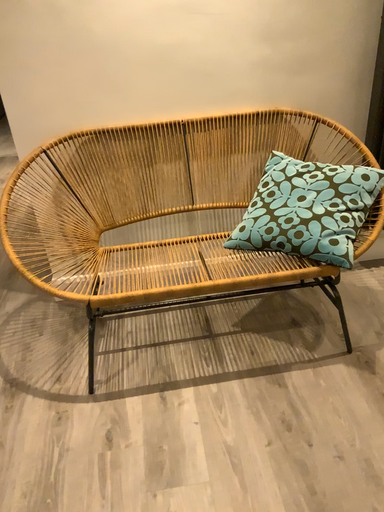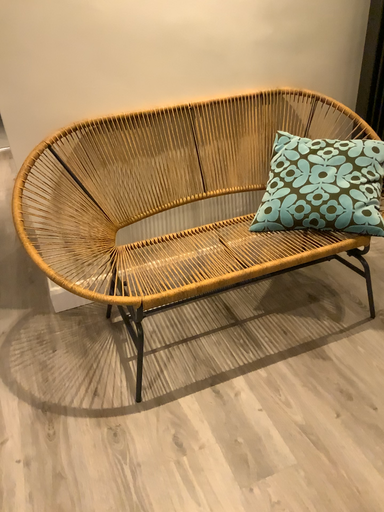
Question: How did the camera likely rotate when shooting the video?

Choices:
 (A) rotated left
 (B) rotated right

Answer: (B)